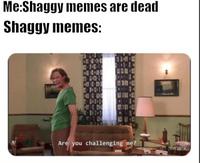
Locate an element on the screen. picture frame is located at coordinates (48, 90).